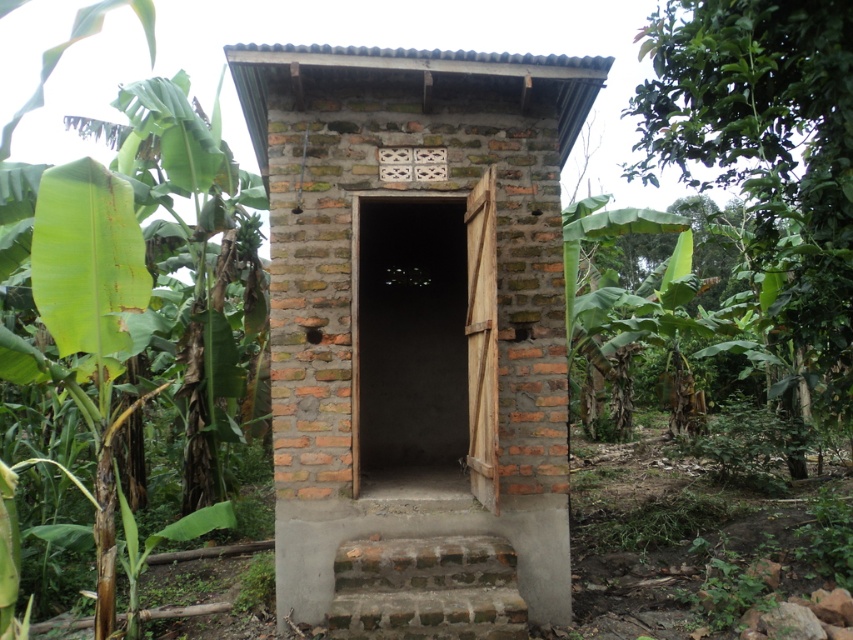
Can you confirm if green leafy banana tree at left is positioned above brick stairs at lower center?

Yes.

Between point (109, 273) and point (346, 566), which one is positioned in front?

Point (346, 566) is more forward.

Measure the distance between green leafy banana tree at left and camera.

They are 6.57 meters apart.

Identify the location of green leafy banana tree at left. The image size is (853, 640). (123, 323).

Can you confirm if brick/rough wall hut at center is positioned below green leafy banana tree at left?

Correct, brick/rough wall hut at center is located below green leafy banana tree at left.

The image size is (853, 640). Describe the element at coordinates (416, 332) in the screenshot. I see `brick/rough wall hut at center` at that location.

Between point (428, 348) and point (0, 368), which one is positioned in front?

Positioned in front is point (0, 368).

In order to click on brick/rough wall hut at center in this screenshot , I will do `click(416, 332)`.

Between brick/rough wall hut at center and brick stairs at lower center, which one has more height?

Standing taller between the two is brick/rough wall hut at center.

Is brick/rough wall hut at center smaller than brick stairs at lower center?

No, brick/rough wall hut at center is not smaller than brick stairs at lower center.

Who is more forward, (384, 524) or (451, 572)?

Point (451, 572) is more forward.

At what (x,y) coordinates should I click in order to perform the action: click on brick/rough wall hut at center. Please return your answer as a coordinate pair (x, y). The width and height of the screenshot is (853, 640). Looking at the image, I should click on (416, 332).